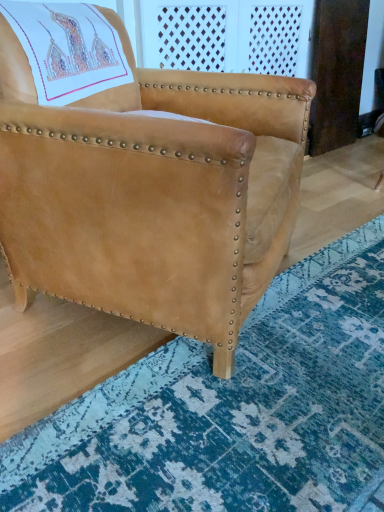
Question: Should I look upward or downward to see suede tan chair at center?

Choices:
 (A) down
 (B) up

Answer: (B)

Question: Is suede tan chair at center in contact with blue textured rug at lower right?

Choices:
 (A) no
 (B) yes

Answer: (A)

Question: Is suede tan chair at center turned away from blue textured rug at lower right?

Choices:
 (A) no
 (B) yes

Answer: (A)

Question: Can you confirm if suede tan chair at center is wider than blue textured rug at lower right?

Choices:
 (A) no
 (B) yes

Answer: (A)

Question: Can you confirm if suede tan chair at center is positioned to the left of blue textured rug at lower right?

Choices:
 (A) no
 (B) yes

Answer: (B)

Question: Considering the relative sizes of suede tan chair at center and blue textured rug at lower right in the image provided, is suede tan chair at center thinner than blue textured rug at lower right?

Choices:
 (A) yes
 (B) no

Answer: (A)

Question: Is suede tan chair at center positioned before blue textured rug at lower right?

Choices:
 (A) no
 (B) yes

Answer: (A)

Question: Can you confirm if blue textured rug at lower right is bigger than suede tan chair at center?

Choices:
 (A) no
 (B) yes

Answer: (A)

Question: Is blue textured rug at lower right facing away from suede tan chair at center?

Choices:
 (A) no
 (B) yes

Answer: (A)

Question: Is the depth of blue textured rug at lower right greater than that of suede tan chair at center?

Choices:
 (A) no
 (B) yes

Answer: (A)

Question: Does blue textured rug at lower right lie in front of suede tan chair at center?

Choices:
 (A) yes
 (B) no

Answer: (A)

Question: Is blue textured rug at lower right placed right next to suede tan chair at center?

Choices:
 (A) no
 (B) yes

Answer: (A)

Question: Is blue textured rug at lower right far from suede tan chair at center?

Choices:
 (A) yes
 (B) no

Answer: (B)

Question: Would you say blue textured rug at lower right is inside or outside suede tan chair at center?

Choices:
 (A) outside
 (B) inside

Answer: (A)